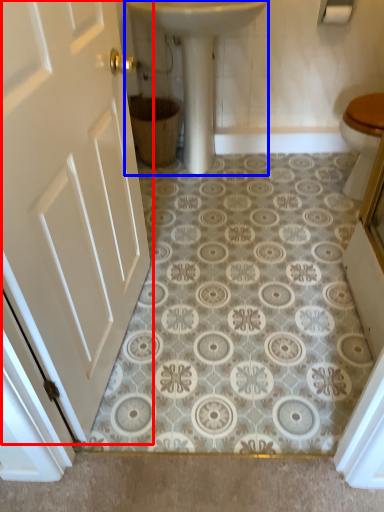
Question: Which point is closer to the camera, door (highlighted by a red box) or sink (highlighted by a blue box)?

Choices:
 (A) door
 (B) sink

Answer: (A)